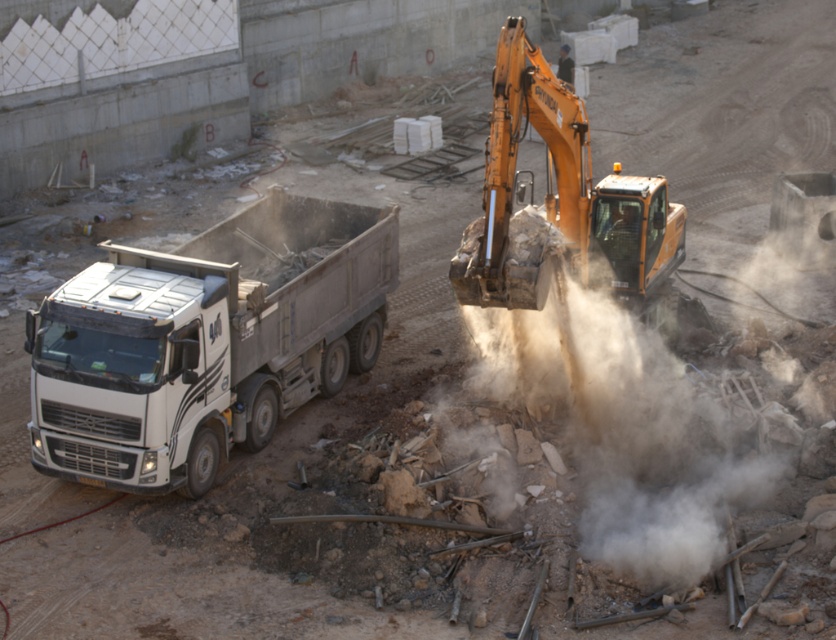
Question: Is brown dusty debris at center below orange metallic excavator at upper right?

Choices:
 (A) yes
 (B) no

Answer: (A)

Question: Does white metallic truck at left have a larger size compared to brown dusty debris at center?

Choices:
 (A) no
 (B) yes

Answer: (A)

Question: Which point is closer to the camera taking this photo?

Choices:
 (A) (508, 120)
 (B) (202, 417)

Answer: (A)

Question: Which of the following is the farthest from the observer?

Choices:
 (A) orange metallic excavator at upper right
 (B) brown dusty debris at center
 (C) white metallic truck at left

Answer: (A)

Question: Is white metallic truck at left smaller than brown dusty debris at center?

Choices:
 (A) no
 (B) yes

Answer: (B)

Question: Which of the following is the farthest from the observer?

Choices:
 (A) coord(533,396)
 (B) coord(125,451)
 (C) coord(656,248)

Answer: (C)